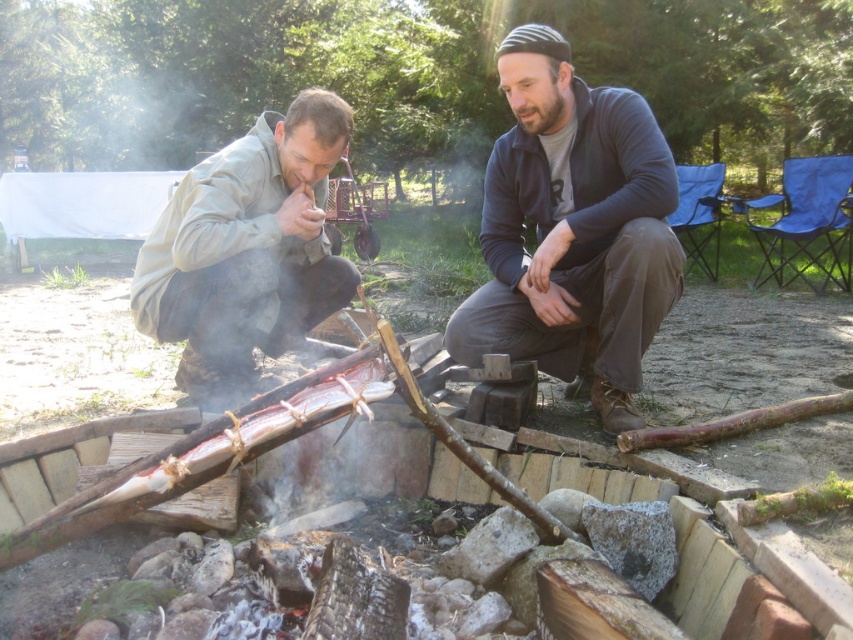
Who is shorter, dark blue sweater at center or matte khaki jacket at left?

Standing shorter between the two is matte khaki jacket at left.

Is point (543, 278) in front of point (332, 93)?

That is True.

At what (x,y) coordinates should I click in order to perform the action: click on dark blue sweater at center. Please return your answer as a coordinate pair (x, y). Looking at the image, I should click on (573, 228).